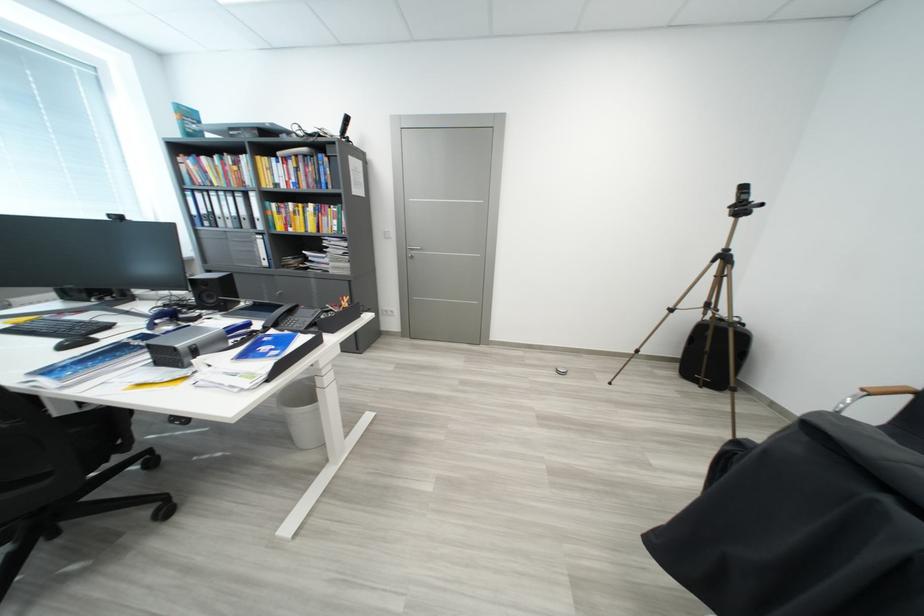
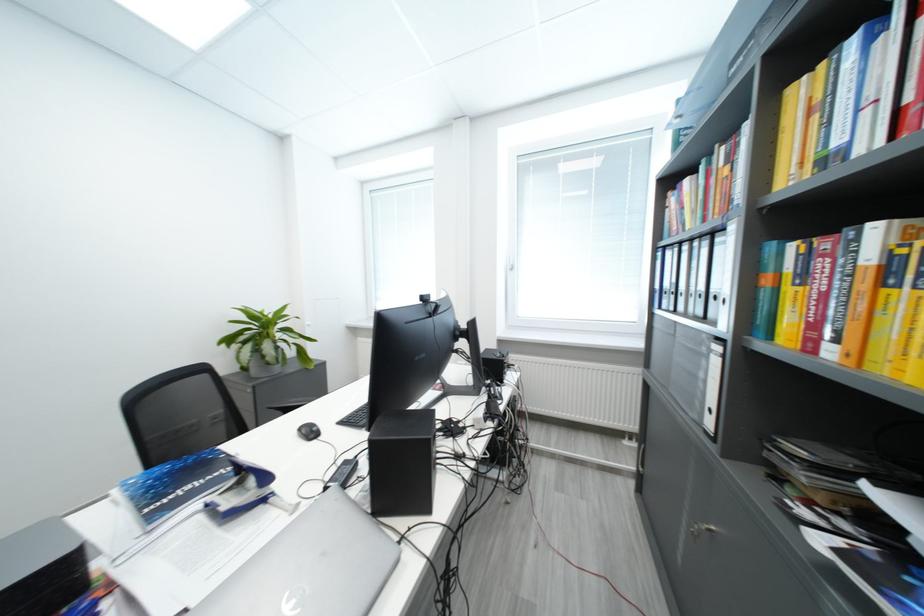
The point at (191, 192) is marked in the first image. Where is the corresponding point in the second image?

(664, 253)